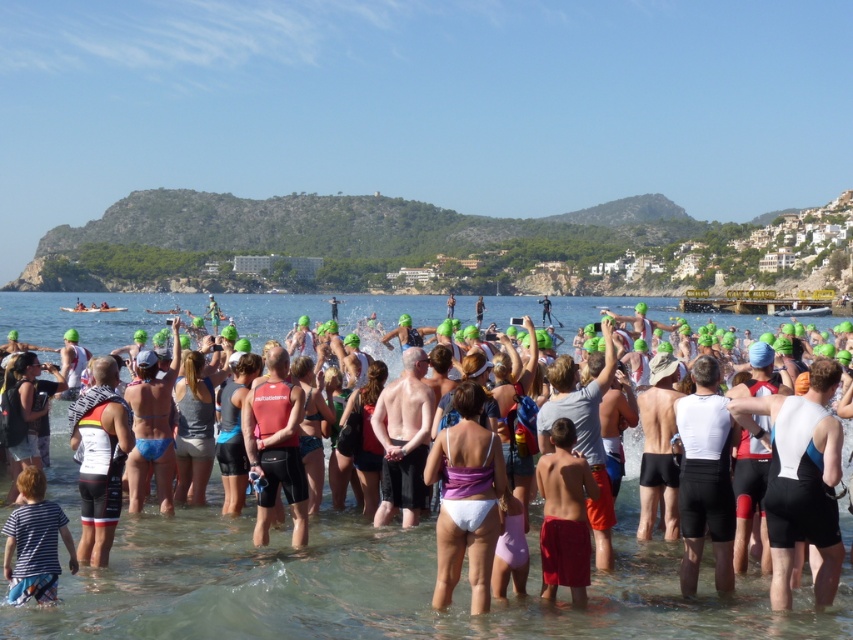
Identify the location of skinny white man at center. (403, 440).

Does point (579, 525) lie in front of point (41, 550)?

No, (579, 525) is further to viewer.

Can you confirm if red cotton shorts at center is positioned below striped cotton shirt at lower left?

Incorrect, red cotton shorts at center is not positioned below striped cotton shirt at lower left.

Does point (553, 554) come behind point (13, 548)?

Yes, it is behind point (13, 548).

Where is `red cotton shorts at center`? red cotton shorts at center is located at coordinates (564, 515).

Can you confirm if clear water at center is thinner than red cotton shorts at center?

No.

Is clear water at center wider than red cotton shorts at center?

Indeed, clear water at center has a greater width compared to red cotton shorts at center.

Which is in front, point (164, 529) or point (564, 509)?

Point (564, 509) is in front.

In order to click on clear water at center in this screenshot , I will do `click(387, 584)`.